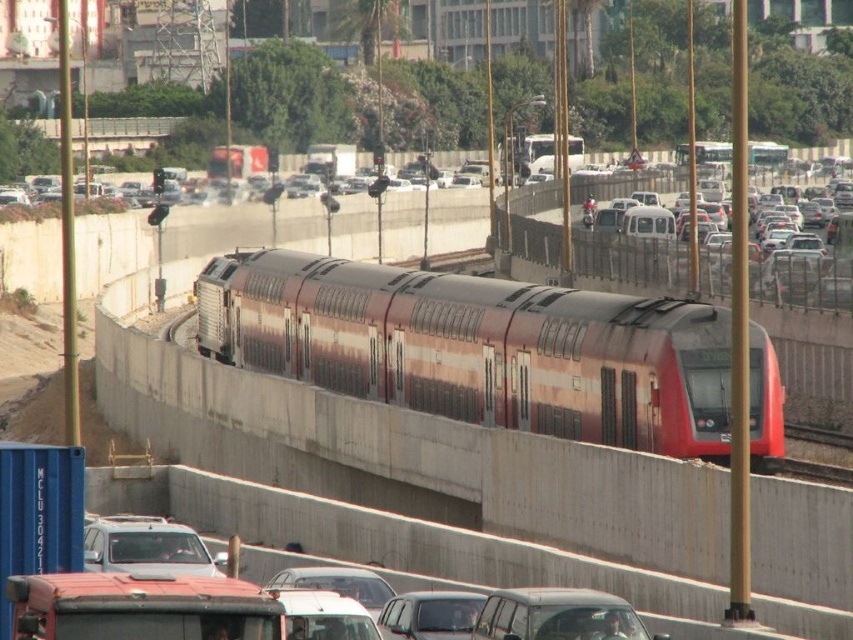
How far apart are metallic silver van at center and silver metallic car at lower left?

A distance of 5.94 meters exists between metallic silver van at center and silver metallic car at lower left.

In the scene shown: Does metallic silver van at center have a larger size compared to silver metallic car at lower left?

A: No.

Image resolution: width=853 pixels, height=640 pixels. In order to click on metallic silver van at center in this screenshot , I will do 556,616.

Who is more distant from viewer, (544, 595) or (410, 593)?

The point (410, 593) is behind.

Can you confirm if metallic silver van at center is shorter than metallic silver car at center?

No.

Is point (505, 589) closer to viewer compared to point (392, 624)?

No, it is not.

Where is `metallic silver van at center`? metallic silver van at center is located at coordinates (556, 616).

This screenshot has height=640, width=853. Describe the element at coordinates (479, 348) in the screenshot. I see `metallic red train at center` at that location.

Can you confirm if metallic red train at center is positioned below metallic silver car at center?

Actually, metallic red train at center is above metallic silver car at center.

Is point (618, 317) positioned in front of point (456, 611)?

No, it is behind (456, 611).

At what (x,y) coordinates should I click in order to perform the action: click on metallic red train at center. Please return your answer as a coordinate pair (x, y). Image resolution: width=853 pixels, height=640 pixels. Looking at the image, I should click on (479, 348).